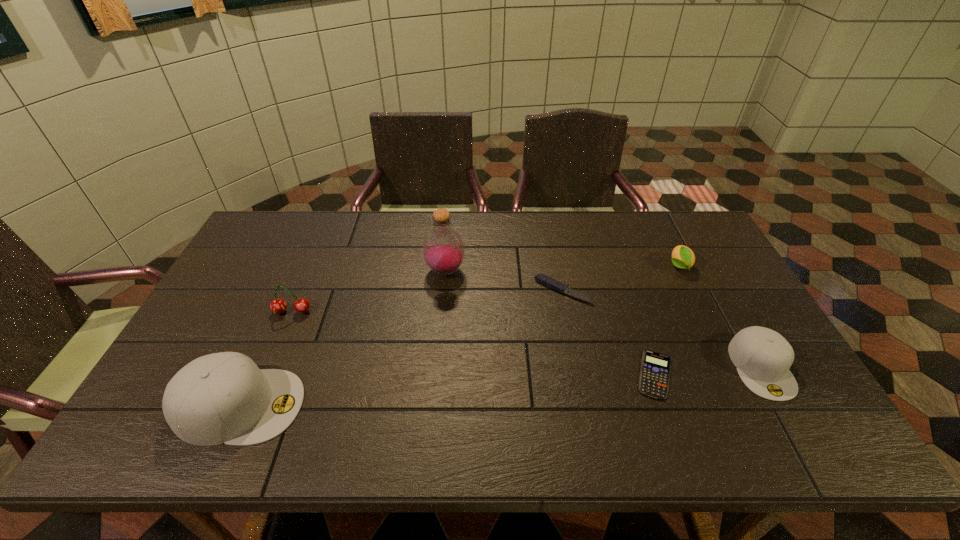
This screenshot has height=540, width=960. I want to click on lemon that is positioned at the right edge, so click(683, 257).

Identify the location of object present at the near left corner. tap(224, 397).

At what (x,y) coordinates should I click in order to perform the action: click on object situated at the near right corner. Please return your answer as a coordinate pair (x, y). The width and height of the screenshot is (960, 540). Looking at the image, I should click on (763, 357).

This screenshot has width=960, height=540. In the image, there is a desktop. Find the location of `free space at the far edge`. free space at the far edge is located at coordinates (466, 212).

This screenshot has width=960, height=540. In order to click on vacant space at the near edge in this screenshot , I will do `click(436, 390)`.

The width and height of the screenshot is (960, 540). In order to click on vacant space at the left edge of the desktop in this screenshot , I will do `click(175, 367)`.

In the image, there is a desktop. Where is `free region at the far left corner`? The width and height of the screenshot is (960, 540). free region at the far left corner is located at coordinates (267, 222).

Where is `vacant space at the far right corner of the desktop`? vacant space at the far right corner of the desktop is located at coordinates (680, 212).

You are a GUI agent. You are given a task and a screenshot of the screen. Output one action in this format:
    pyautogui.click(x=<x>, y=<y>)
    Task: Click on the vacant point located between the fifth tallest object and the cherry
    This screenshot has width=960, height=540.
    Given the screenshot: What is the action you would take?
    click(486, 289)

Identify the location of free point between the fourth object from left to right and the tallest object. This screenshot has width=960, height=540. (504, 281).